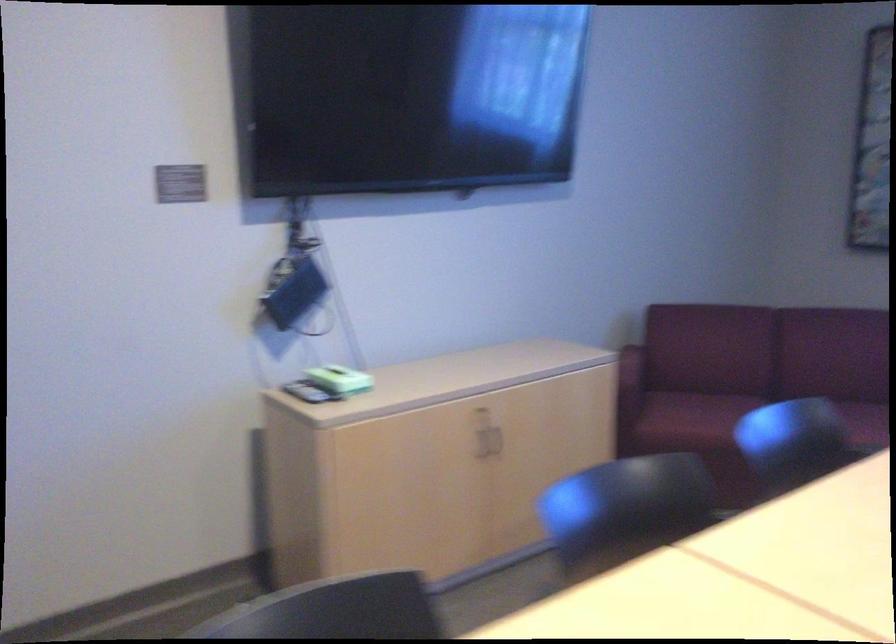
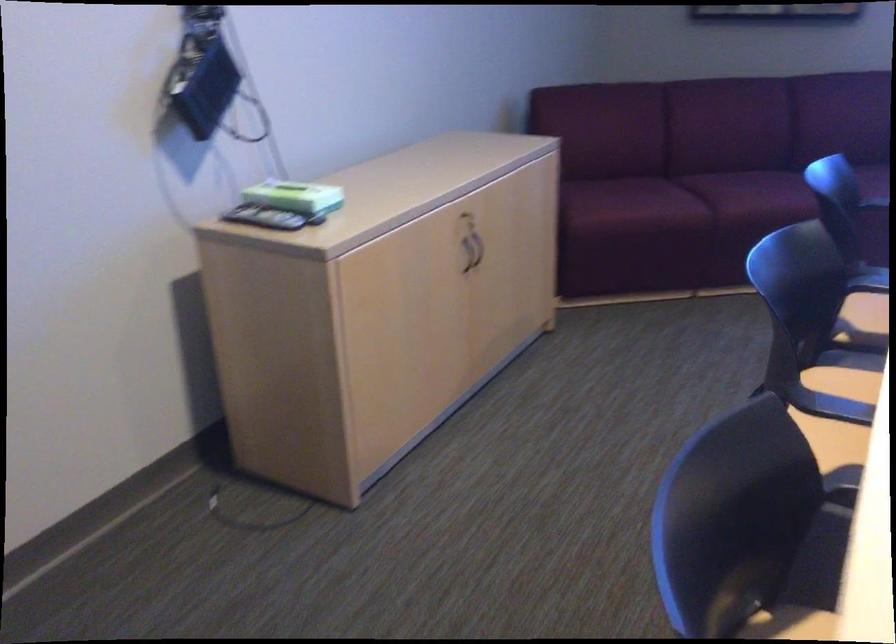
The point at (483, 446) is marked in the first image. Where is the corresponding point in the second image?

(464, 259)